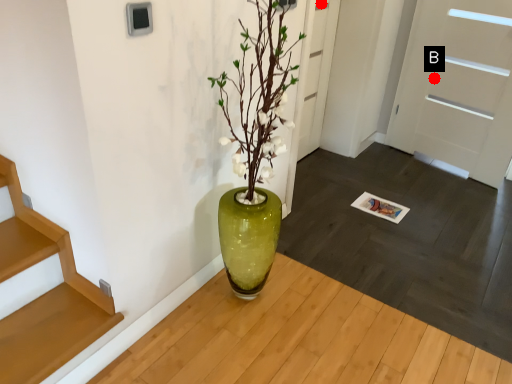
Question: Two points are circled on the image, labeled by A and B beside each circle. Which point appears closest to the camera in this image?

Choices:
 (A) A is closer
 (B) B is closer

Answer: (A)